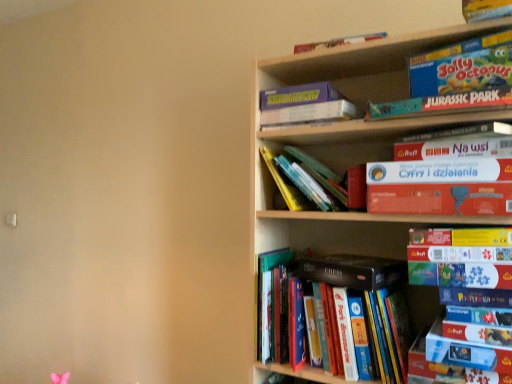
Find the location of a particular element. This screenshot has width=512, height=384. wooden bookshelf at upper right is located at coordinates (352, 141).

What is the approximate width of wooden bookshelf at upper right?

A: The width of wooden bookshelf at upper right is 11.46 inches.

Measure the distance between blue cardboard puzzle at lower right, placed as the third book when sorted from bottom to top, and camera.

3.31 feet.

Where is `blue cardboard puzzle at lower right, placed as the third book when sorted from bottom to top`? This screenshot has width=512, height=384. blue cardboard puzzle at lower right, placed as the third book when sorted from bottom to top is located at coordinates (475, 297).

What do you see at coordinates (441, 104) in the screenshot? The width and height of the screenshot is (512, 384). I see `teal cardboard jurassic park book at upper right, the fifth book viewed from the top` at bounding box center [441, 104].

Where is `purple cardboard game at upper center, which appears as the 10th book when ordered from the bottom`? purple cardboard game at upper center, which appears as the 10th book when ordered from the bottom is located at coordinates (305, 105).

Locate an element on the screen. matte cardboard book at lower right, acting as the 11th book starting from the top is located at coordinates (x=477, y=333).

Describe the element at coordinates (461, 257) in the screenshot. The image size is (512, 384). I see `blue cardboard puzzle at upper right, the 4th book in the bottom-to-top sequence` at that location.

Where is `white cardboard book at upper right, acting as the sixth book starting from the top`? This screenshot has width=512, height=384. white cardboard book at upper right, acting as the sixth book starting from the top is located at coordinates (440, 171).

Is hardcover books at center, which is the 12th book in top-to-bottom order, touching wooden bookshelf at upper right?

There is a gap between hardcover books at center, which is the 12th book in top-to-bottom order, and wooden bookshelf at upper right.

Could you tell me if hardcover books at center, which is the 12th book in top-to-bottom order, is facing wooden bookshelf at upper right?

Yes, hardcover books at center, which is the 12th book in top-to-bottom order, is turned towards wooden bookshelf at upper right.

Considering the relative sizes of hardcover books at center, which ranks as the first book in bottom-to-top order, and wooden bookshelf at upper right in the image provided, is hardcover books at center, which ranks as the first book in bottom-to-top order, wider than wooden bookshelf at upper right?

In fact, hardcover books at center, which ranks as the first book in bottom-to-top order, might be narrower than wooden bookshelf at upper right.

Can you tell me how much hardcover books at center, which ranks as the first book in bottom-to-top order, and wooden bookshelf at upper right differ in facing direction?

0.000877 degrees separate the facing orientations of hardcover books at center, which ranks as the first book in bottom-to-top order, and wooden bookshelf at upper right.

Does point (286, 113) appear closer or farther from the camera than point (373, 321)?

Clearly, point (286, 113) is more distant from the camera than point (373, 321).

From the image's perspective, is purple cardboard game at upper center, which appears as the 10th book when ordered from the bottom, beneath hardcover books at center, which ranks as the first book in bottom-to-top order?

Actually, purple cardboard game at upper center, which appears as the 10th book when ordered from the bottom, appears above hardcover books at center, which ranks as the first book in bottom-to-top order, in the image.

How different are the orientations of purple cardboard game at upper center, which appears as the 10th book when ordered from the bottom, and hardcover books at center, which ranks as the first book in bottom-to-top order, in degrees?

The facing directions of purple cardboard game at upper center, which appears as the 10th book when ordered from the bottom, and hardcover books at center, which ranks as the first book in bottom-to-top order, are 4.05 degrees apart.

Based on the photo, which is farther, (389, 175) or (466, 82)?

Point (389, 175)

Would you consider white cardboard book at upper right, acting as the sixth book starting from the top, to be distant from matte board game at upper right, which ranks as the 4th book in top-to-bottom order?

white cardboard book at upper right, acting as the sixth book starting from the top, is actually quite close to matte board game at upper right, which ranks as the 4th book in top-to-bottom order.

From a real-world perspective, which is physically below, white cardboard book at upper right, which appears as the seventh book when ordered from the bottom, or matte board game at upper right, arranged as the 9th book when ordered from the bottom?

white cardboard book at upper right, which appears as the seventh book when ordered from the bottom, from a real-world perspective.

Is teal cardboard jurassic park book at upper right, the fifth book viewed from the top, turned away from wooden bookshelf at upper right?

Yes, wooden bookshelf at upper right is at the back of teal cardboard jurassic park book at upper right, the fifth book viewed from the top.

Considering the positions of objects teal cardboard jurassic park book at upper right, the fifth book viewed from the top, and wooden bookshelf at upper right in the image provided, who is more to the right, teal cardboard jurassic park book at upper right, the fifth book viewed from the top, or wooden bookshelf at upper right?

teal cardboard jurassic park book at upper right, the fifth book viewed from the top.

Which object is thinner, teal cardboard jurassic park book at upper right, the fifth book viewed from the top, or wooden bookshelf at upper right?

teal cardboard jurassic park book at upper right, the fifth book viewed from the top.

Locate an element on the screen. This screenshot has height=384, width=512. bookcase that is on the left side of teal cardboard jurassic park book at upper right, which is the 8th book in bottom-to-top order is located at coordinates (352, 141).

Looking at the image, does matte board game at upper right, arranged as the 9th book when ordered from the bottom, seem bigger or smaller compared to matte board game at upper right, which appears as the 11th book when ordered from the bottom?

Clearly, matte board game at upper right, arranged as the 9th book when ordered from the bottom, is larger in size than matte board game at upper right, which appears as the 11th book when ordered from the bottom.

Is matte board game at upper right, arranged as the 9th book when ordered from the bottom, beside matte board game at upper right, which appears as the 11th book when ordered from the bottom?

Yes, matte board game at upper right, arranged as the 9th book when ordered from the bottom, is next to matte board game at upper right, which appears as the 11th book when ordered from the bottom.

Which of these two, matte board game at upper right, arranged as the 9th book when ordered from the bottom, or matte board game at upper right, marked as the 2th book in a top-to-bottom arrangement, is thinner?

With smaller width is matte board game at upper right, marked as the 2th book in a top-to-bottom arrangement.

Is matte board game at upper right, which ranks as the 4th book in top-to-bottom order, at the right side of matte board game at upper right, which appears as the 11th book when ordered from the bottom?

In fact, matte board game at upper right, which ranks as the 4th book in top-to-bottom order, is to the left of matte board game at upper right, which appears as the 11th book when ordered from the bottom.

Considering the points (495, 6) and (289, 107), which point is behind, point (495, 6) or point (289, 107)?

Positioned behind is point (289, 107).

Considering the relative sizes of matte cardboard box at upper right, marked as the 12th book in a bottom-to-top arrangement, and purple cardboard game at upper center, the third book in the top-to-bottom sequence, in the image provided, is matte cardboard box at upper right, marked as the 12th book in a bottom-to-top arrangement, smaller than purple cardboard game at upper center, the third book in the top-to-bottom sequence,?

Yes.

How much distance is there between matte cardboard box at upper right, arranged as the 1th book when viewed from the top, and purple cardboard game at upper center, the third book in the top-to-bottom sequence?

matte cardboard box at upper right, arranged as the 1th book when viewed from the top, is 18.82 inches from purple cardboard game at upper center, the third book in the top-to-bottom sequence.

From a real-world perspective, does wooden bookshelf at upper right stand above hardcover books at center, which is the 12th book in top-to-bottom order?

Yes, from a real-world perspective, wooden bookshelf at upper right is on top of hardcover books at center, which is the 12th book in top-to-bottom order.

Does wooden bookshelf at upper right touch hardcover books at center, which is the 12th book in top-to-bottom order?

No.

Is wooden bookshelf at upper right positioned with its back to hardcover books at center, which ranks as the first book in bottom-to-top order?

Correct, wooden bookshelf at upper right is looking away from hardcover books at center, which ranks as the first book in bottom-to-top order.

Looking at their sizes, would you say wooden bookshelf at upper right is wider or thinner than hardcover books at center, which ranks as the first book in bottom-to-top order?

In the image, wooden bookshelf at upper right appears to be wider than hardcover books at center, which ranks as the first book in bottom-to-top order.

Identify the location of book that is the 1st object to the left of the wooden bookshelf at upper right, starting at the anchor. This screenshot has height=384, width=512. (379, 307).

Locate an element on the screen. book that is the 9th object located below the purple cardboard game at upper center, which appears as the 10th book when ordered from the bottom (from the image's perspective) is located at coordinates (379, 307).

Estimate the real-world distances between objects in this image. Which object is further from blue cardboard puzzle at lower right, placed as the third book when sorted from bottom to top, matte cardboard book at lower right, the 2th book positioned from the bottom, or purple cardboard game at upper center, the third book in the top-to-bottom sequence?

Based on the image, purple cardboard game at upper center, the third book in the top-to-bottom sequence, appears to be further to blue cardboard puzzle at lower right, placed as the third book when sorted from bottom to top.

Estimate the real-world distances between objects in this image. Which object is further from hardcover chess book at center, which ranks as the 2th paperback book in top-to-bottom order, blue cardboard puzzle at lower right, arranged as the 10th book when viewed from the top, or matte cardboard book at lower right, acting as the 11th book starting from the top?

matte cardboard book at lower right, acting as the 11th book starting from the top, lies further to hardcover chess book at center, which ranks as the 2th paperback book in top-to-bottom order, than the other object.

Based on their spatial positions, is matte cardboard box at upper right, marked as the 12th book in a bottom-to-top arrangement, or orange matte board game at upper right, the 2th paperback book positioned from the bottom, further from teal cardboard jurassic park book at upper right, the fifth book viewed from the top?

The object further to teal cardboard jurassic park book at upper right, the fifth book viewed from the top, is matte cardboard box at upper right, marked as the 12th book in a bottom-to-top arrangement.

Which object lies nearer to the anchor point purple cardboard game at upper center, which appears as the 10th book when ordered from the bottom, blue cardboard puzzle at lower right, placed as the third book when sorted from bottom to top, or matte cardboard box at upper right, arranged as the 1th book when viewed from the top?

matte cardboard box at upper right, arranged as the 1th book when viewed from the top, lies closer to purple cardboard game at upper center, which appears as the 10th book when ordered from the bottom, than the other object.

Estimate the real-world distances between objects in this image. Which object is further from orange matte board game at upper right, the 2th paperback book positioned from the bottom, matte board game at upper right, which ranks as the 4th book in top-to-bottom order, or matte cardboard book at lower right, acting as the 11th book starting from the top?

The object further to orange matte board game at upper right, the 2th paperback book positioned from the bottom, is matte cardboard book at lower right, acting as the 11th book starting from the top.

When comparing their distances from matte yellow puzzle box at right, positioned as the 5th book in bottom-to-top order, does hardcover books at center, which ranks as the first book in bottom-to-top order, or wooden bookshelf at upper right seem further?

wooden bookshelf at upper right is further to matte yellow puzzle box at right, positioned as the 5th book in bottom-to-top order.

Looking at the image, which one is located closer to wooden bookshelf at upper right, blue cardboard puzzle at upper right, the 4th book in the bottom-to-top sequence, or matte cardboard box at upper right, marked as the 12th book in a bottom-to-top arrangement?

blue cardboard puzzle at upper right, the 4th book in the bottom-to-top sequence.

Estimate the real-world distances between objects in this image. Which object is closer to matte board game at upper right, which appears as the 11th book when ordered from the bottom, purple cardboard game at upper center, which appears as the 10th book when ordered from the bottom, or white cardboard book at upper right, acting as the sixth book starting from the top?

white cardboard book at upper right, acting as the sixth book starting from the top, is positioned closer to the anchor matte board game at upper right, which appears as the 11th book when ordered from the bottom.

Image resolution: width=512 pixels, height=384 pixels. I want to click on bookcase between yellow matte book at center, which is the 6th book in bottom-to-top order, and blue cardboard puzzle at upper right, the 4th book in the bottom-to-top sequence, so click(x=352, y=141).

Identify the location of paperback book situated between hardcover chess book at center, which ranks as the 2th paperback book in top-to-bottom order, and matte yellow puzzle box at right, positioned as the 5th book in bottom-to-top order, from left to right. This screenshot has height=384, width=512. (441, 199).

Identify the location of bookcase that lies between matte board game at upper right, arranged as the 9th book when ordered from the bottom, and blue cardboard puzzle at lower right, placed as the third book when sorted from bottom to top, from top to bottom. Image resolution: width=512 pixels, height=384 pixels. (352, 141).

Image resolution: width=512 pixels, height=384 pixels. I want to click on bookcase that lies between white cardboard book at upper right, which appears as the seventh book when ordered from the bottom, and blue cardboard puzzle at lower right, placed as the third book when sorted from bottom to top, from top to bottom, so click(352, 141).